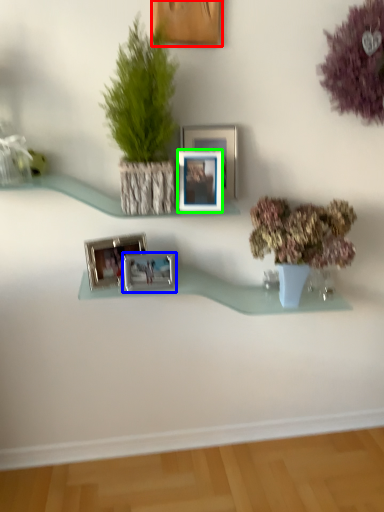
Question: Estimate the real-world distances between objects in this image. Which object is farther from picture frame (highlighted by a red box), picture frame (highlighted by a blue box) or picture frame (highlighted by a green box)?

Choices:
 (A) picture frame
 (B) picture frame

Answer: (A)